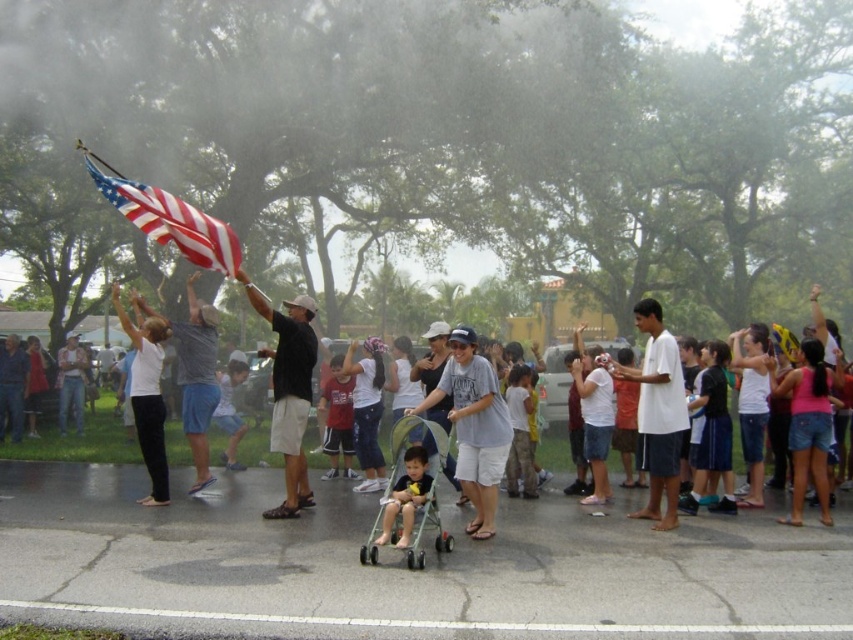
Which is below, matte gray t-shirt at center or white cotton shirt at right?

matte gray t-shirt at center is below.

Between matte gray t-shirt at center and white cotton shirt at right, which one is positioned higher?

white cotton shirt at right

Describe the element at coordinates (474, 426) in the screenshot. I see `matte gray t-shirt at center` at that location.

Locate an element on the screen. This screenshot has width=853, height=640. matte gray t-shirt at center is located at coordinates (474, 426).

Consider the image. Which of these two, green plastic stroller at center or matte black stroller at center, stands taller?

A: green plastic stroller at center is taller.

In the scene shown: Is green plastic stroller at center closer to the viewer compared to matte black stroller at center?

Yes.

Describe the element at coordinates (426, 490) in the screenshot. I see `green plastic stroller at center` at that location.

Where is `green plastic stroller at center`? The image size is (853, 640). green plastic stroller at center is located at coordinates pos(426,490).

Between point (270, 509) and point (202, 426), which one is positioned in front?

Positioned in front is point (270, 509).

Which is above, black cotton shirt at center or gray cotton t-shirt at upper left?

Positioned higher is black cotton shirt at center.

Where is `black cotton shirt at center`? black cotton shirt at center is located at coordinates (289, 392).